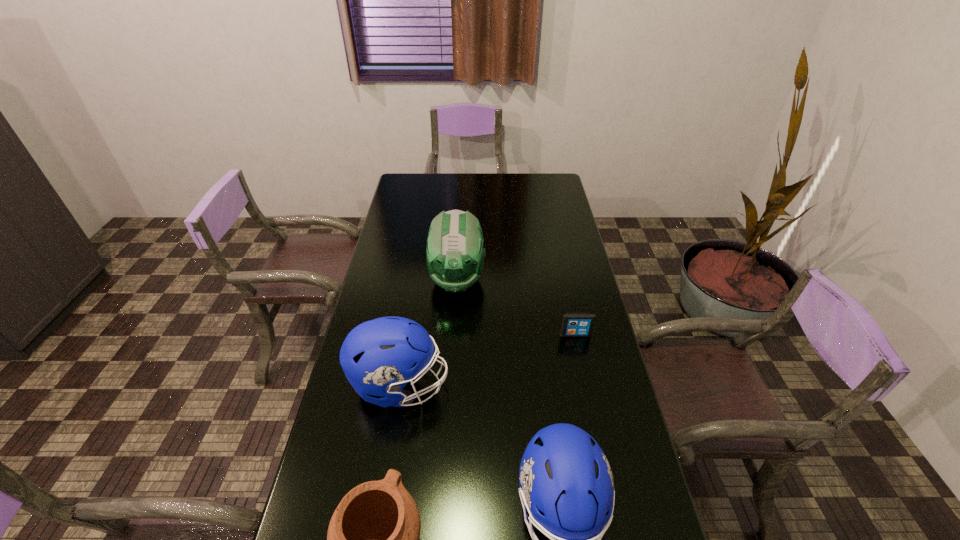
Where is `free space at the left edge`? The image size is (960, 540). free space at the left edge is located at coordinates (407, 318).

This screenshot has width=960, height=540. Identify the location of blank area at the right edge. (587, 269).

What are the coordinates of `free location at the far right corner of the desktop` in the screenshot? It's located at (528, 180).

At what (x,y) coordinates should I click in order to perform the action: click on empty space between the farthest object and the shortest object. Please return your answer as a coordinate pair (x, y). Looking at the image, I should click on (516, 307).

Where is `free spot between the farthest football helmet and the shortest object`? This screenshot has height=540, width=960. free spot between the farthest football helmet and the shortest object is located at coordinates (516, 307).

The image size is (960, 540). Identify the location of blank region between the farthest object and the iPod. (516, 307).

Find the location of a particular element. This screenshot has height=540, width=960. object that stands as the third closest to the farthest object is located at coordinates (566, 484).

Where is `object that stands as the fourth closest to the farthest football helmet`? The height and width of the screenshot is (540, 960). object that stands as the fourth closest to the farthest football helmet is located at coordinates (373, 536).

Select which football helmet is the third closest to the second shortest object. Please provide its 2D coordinates. Your answer should be formatted as a tuple, i.e. [(x, y)], where the tuple contains the x and y coordinates of a point satisfying the conditions above.

[(455, 255)]

Where is `the second closest football helmet relative to the nearest football helmet`? the second closest football helmet relative to the nearest football helmet is located at coordinates (455, 255).